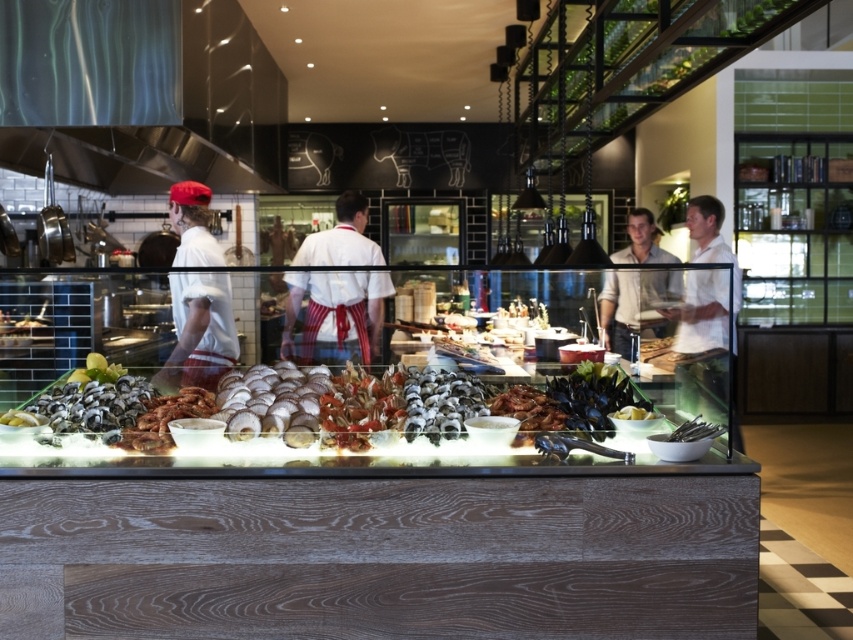
Question: Does white linen shirt at right have a lesser width compared to light beige shirt at center?

Choices:
 (A) yes
 (B) no

Answer: (B)

Question: Which of the following is the farthest from the observer?

Choices:
 (A) (659, 285)
 (B) (45, 413)

Answer: (A)

Question: Estimate the real-world distances between objects in this image. Which object is farther from the matte white shirt at left?

Choices:
 (A) shiny silver seafood at center
 (B) white linen shirt at right
 (C) white striped apron at center
 (D) light beige shirt at center

Answer: (D)

Question: Which point is farther to the camera?

Choices:
 (A) (335, 257)
 (B) (671, 257)
 (C) (734, 422)
 (D) (227, 428)

Answer: (B)

Question: Does white striped apron at center have a lesser width compared to matte white shirt at left?

Choices:
 (A) yes
 (B) no

Answer: (B)

Question: Considering the relative positions of white striped apron at center and white linen shirt at right in the image provided, where is white striped apron at center located with respect to white linen shirt at right?

Choices:
 (A) above
 (B) below

Answer: (A)